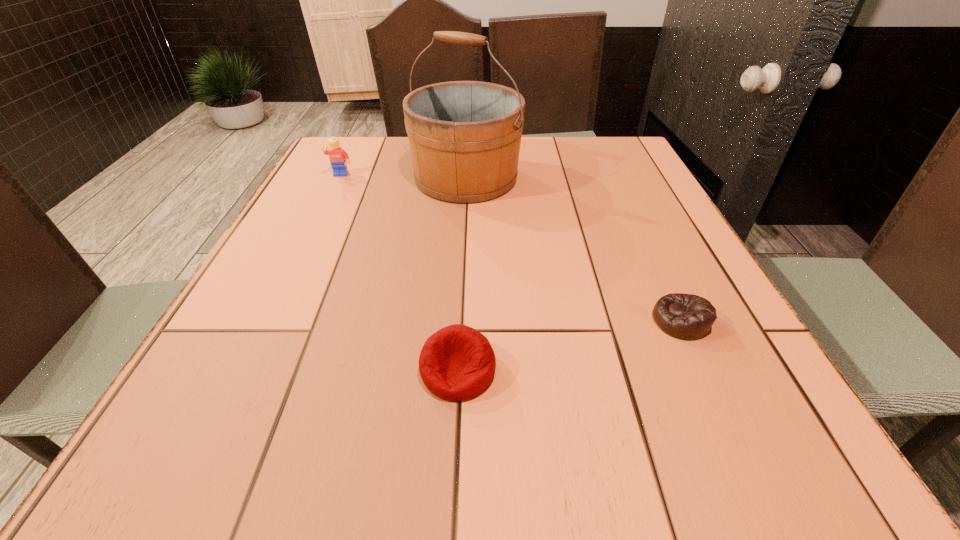
The width and height of the screenshot is (960, 540). I want to click on vacant space situated 0.160m on the front of the rightmost object, so click(730, 426).

Where is `bucket situated at the far edge`? This screenshot has height=540, width=960. bucket situated at the far edge is located at coordinates click(x=464, y=136).

The image size is (960, 540). I want to click on Lego present at the far edge, so click(338, 157).

This screenshot has width=960, height=540. I want to click on object present at the left edge, so pyautogui.click(x=338, y=157).

The width and height of the screenshot is (960, 540). Find the location of `object that is at the right edge`. object that is at the right edge is located at coordinates (684, 316).

Find the location of a particular element. object present at the far left corner is located at coordinates (338, 157).

Where is `free space at the far edge of the desktop`? The width and height of the screenshot is (960, 540). free space at the far edge of the desktop is located at coordinates (556, 148).

Locate an element on the screen. This screenshot has height=540, width=960. free space at the left edge of the desktop is located at coordinates (235, 339).

Locate an element on the screen. The image size is (960, 540). vacant space at the right edge of the desktop is located at coordinates (686, 252).

Where is `free space at the far left corner`? The image size is (960, 540). free space at the far left corner is located at coordinates (374, 164).